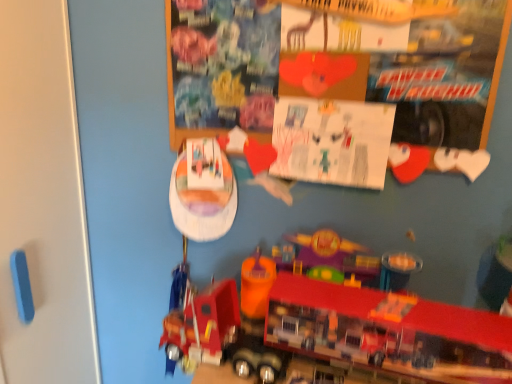
Question: Is white paper at upper center shorter than metallic red truck at lower center?

Choices:
 (A) yes
 (B) no

Answer: (B)

Question: Considering the relative sizes of white paper at upper center and metallic red truck at lower center in the image provided, is white paper at upper center thinner than metallic red truck at lower center?

Choices:
 (A) yes
 (B) no

Answer: (A)

Question: Is white paper at upper center placed right next to metallic red truck at lower center?

Choices:
 (A) no
 (B) yes

Answer: (A)

Question: Considering the relative sizes of white paper at upper center and metallic red truck at lower center in the image provided, is white paper at upper center taller than metallic red truck at lower center?

Choices:
 (A) yes
 (B) no

Answer: (A)

Question: From the image's perspective, is white paper at upper center beneath metallic red truck at lower center?

Choices:
 (A) yes
 (B) no

Answer: (B)

Question: Is white paper at upper center at the right side of metallic red truck at lower center?

Choices:
 (A) no
 (B) yes

Answer: (B)

Question: Is white paper at upper center to the right of wooden bulletin board at upper center from the viewer's perspective?

Choices:
 (A) yes
 (B) no

Answer: (A)

Question: Is white paper at upper center aimed at wooden bulletin board at upper center?

Choices:
 (A) no
 (B) yes

Answer: (B)

Question: Are white paper at upper center and wooden bulletin board at upper center making contact?

Choices:
 (A) no
 (B) yes

Answer: (A)

Question: Considering the relative sizes of white paper at upper center and wooden bulletin board at upper center in the image provided, is white paper at upper center taller than wooden bulletin board at upper center?

Choices:
 (A) yes
 (B) no

Answer: (B)

Question: Does white paper at upper center come behind wooden bulletin board at upper center?

Choices:
 (A) no
 (B) yes

Answer: (B)

Question: Does white paper at upper center have a lesser height compared to wooden bulletin board at upper center?

Choices:
 (A) no
 (B) yes

Answer: (B)

Question: Is wooden bulletin board at upper center to the left of metallic red truck at lower center from the viewer's perspective?

Choices:
 (A) yes
 (B) no

Answer: (B)